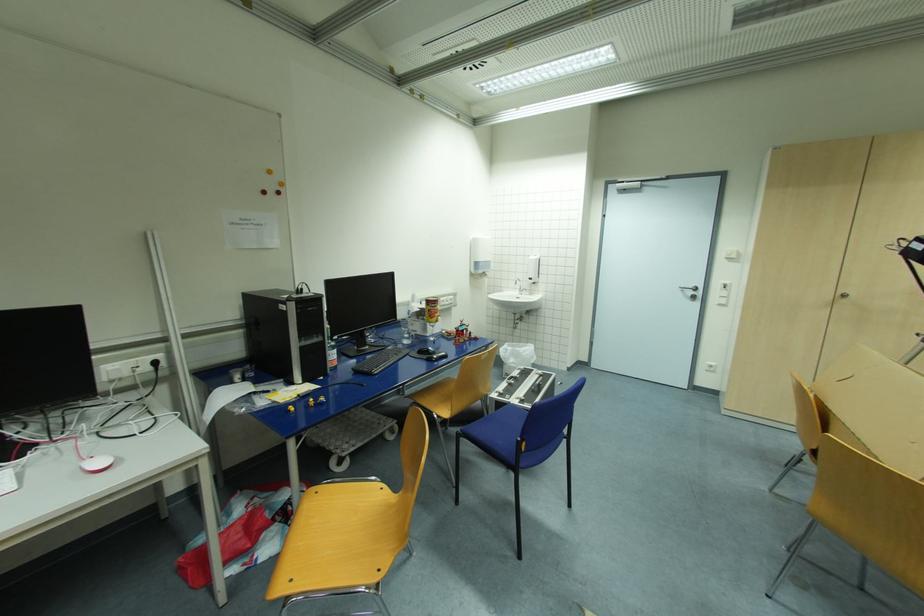
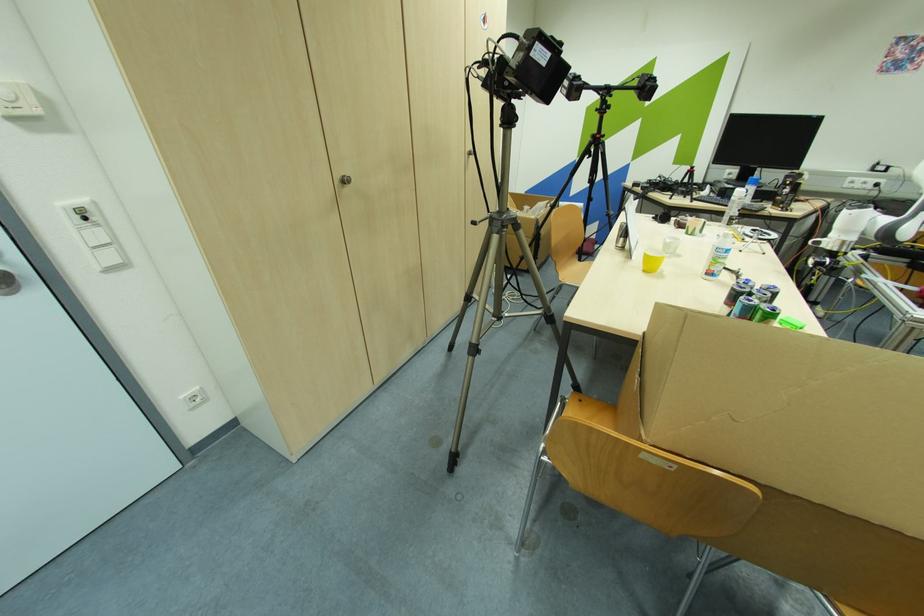
Locate, in the second image, the point that corresponds to [847,296] in the first image.

(348, 182)